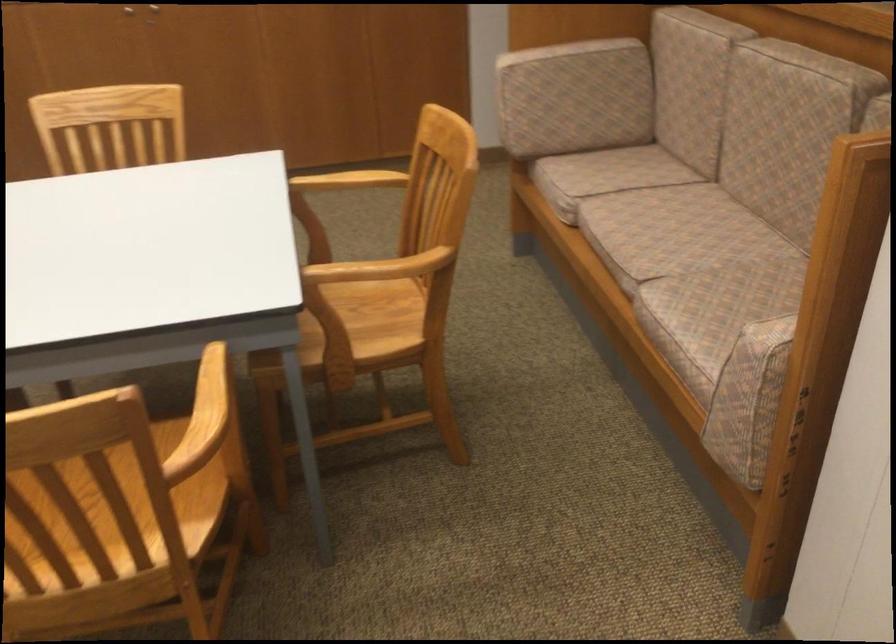
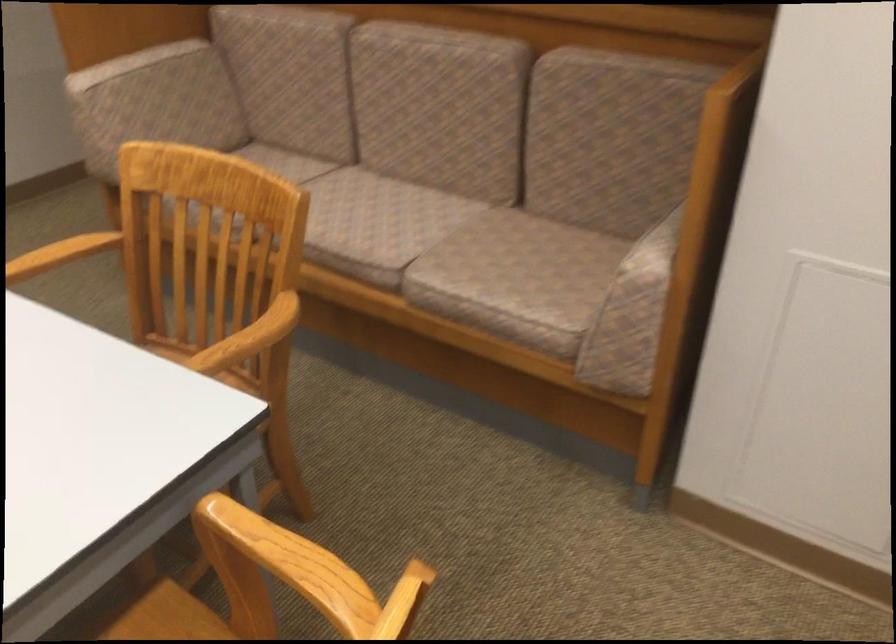
Where in the second image is the point corresponding to (x=380, y=265) from the first image?

(248, 339)